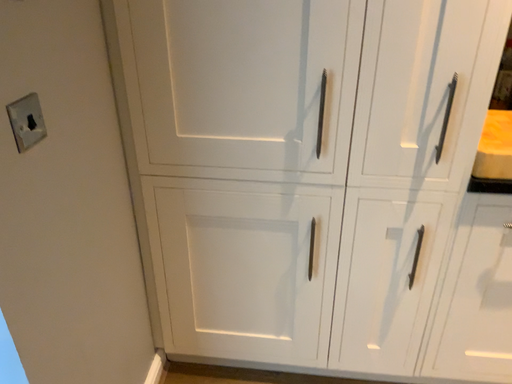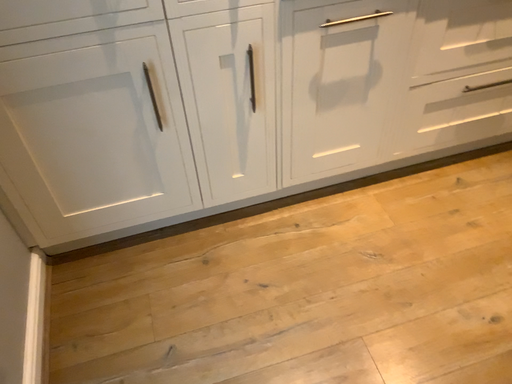
Question: How did the camera likely rotate when shooting the video?

Choices:
 (A) rotated downward
 (B) rotated upward

Answer: (A)